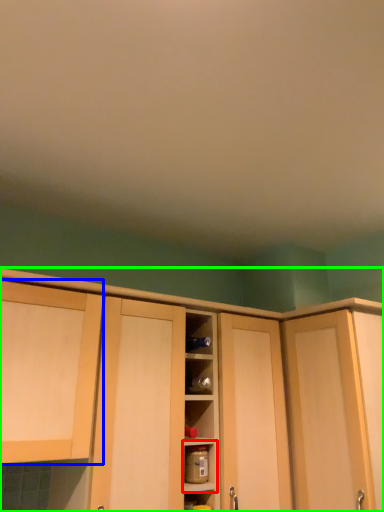
Question: Which object is the closest to the shelf (highlighted by a red box)? Choose among these: cabinetry (highlighted by a blue box) or cabinetry (highlighted by a green box).

Choices:
 (A) cabinetry
 (B) cabinetry

Answer: (A)